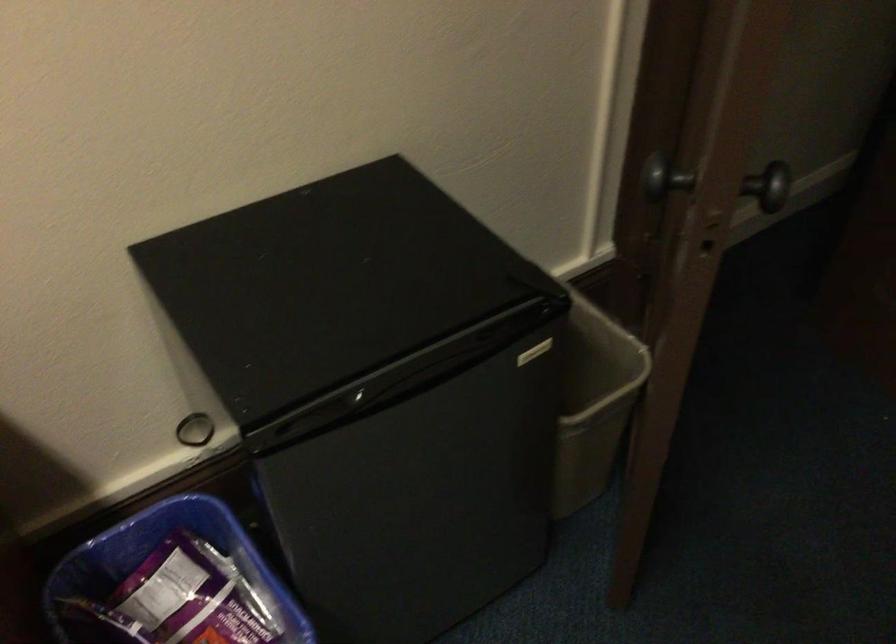
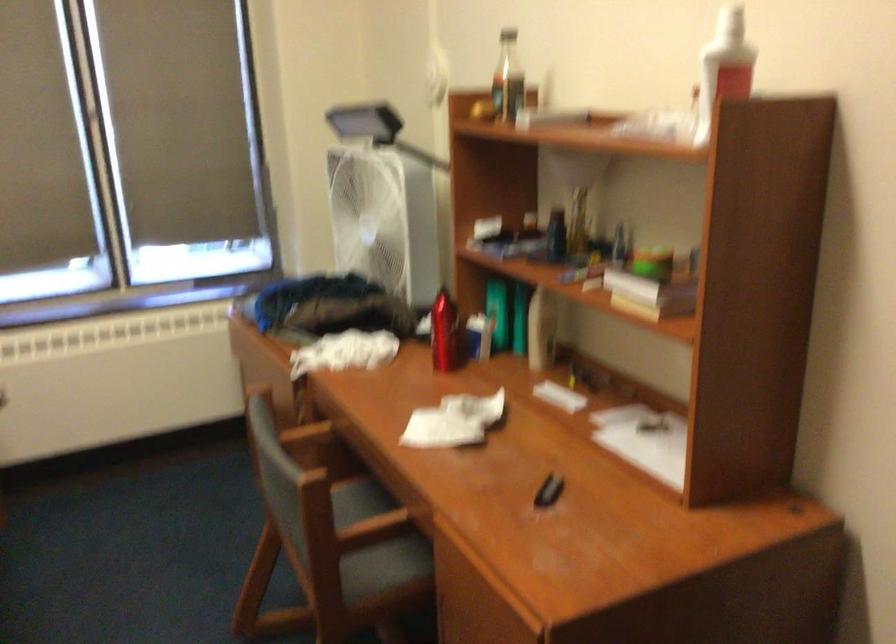
The images are taken continuously from a first-person perspective. In which direction is your viewpoint rotating?

The rotation direction of the camera is left-down.